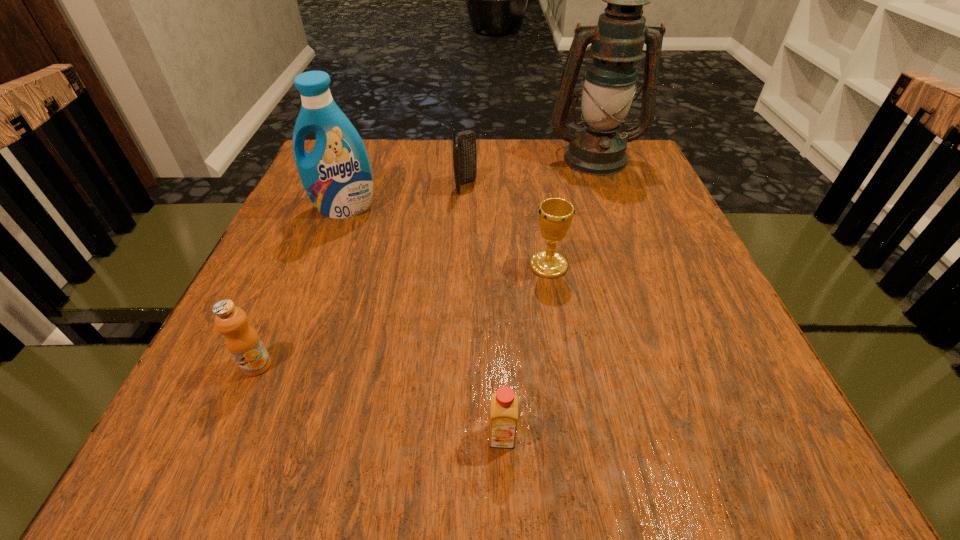
In order to click on the nearer orange juice in this screenshot , I will do `click(504, 404)`.

This screenshot has height=540, width=960. I want to click on the right orange juice, so click(x=504, y=404).

At what (x,y) coordinates should I click in order to perform the action: click on vacant space located on the front of the rightmost object. Please return your answer as a coordinate pair (x, y). This screenshot has height=540, width=960. Looking at the image, I should click on (632, 259).

At what (x,y) coordinates should I click in order to perform the action: click on vacant area situated on the front-facing side of the fifth shortest object. Please return your answer as a coordinate pair (x, y). This screenshot has width=960, height=540. Looking at the image, I should click on (326, 255).

At what (x,y) coordinates should I click in order to perform the action: click on vacant space situated on the keyboard of the third tallest object. Please return your answer as a coordinate pair (x, y). Looking at the image, I should click on (593, 187).

The width and height of the screenshot is (960, 540). Identify the location of vacant space positioned 0.230m on the back of the fourth farthest object. (536, 190).

Find the location of a particular element. free point located on the front label of the fifth farthest object is located at coordinates (222, 447).

The height and width of the screenshot is (540, 960). I want to click on oil lamp situated at the far edge, so click(617, 41).

Where is `cellular telephone that is at the far edge`? cellular telephone that is at the far edge is located at coordinates click(464, 143).

Identify the location of object that is at the near edge. click(x=504, y=404).